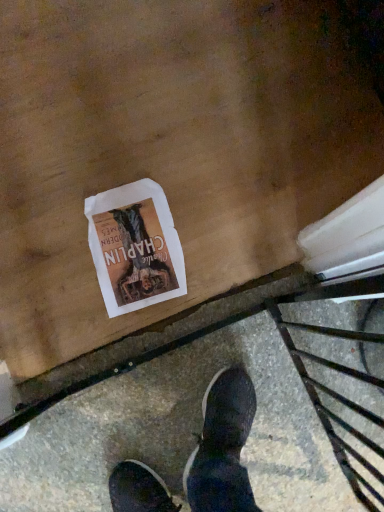
Identify the location of free point to the right of white paper flyer at center. (227, 234).